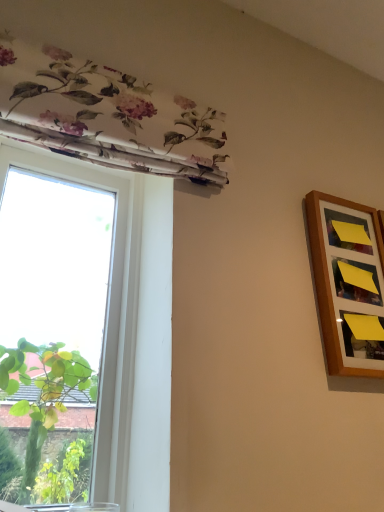
Locate an element on the screen. This screenshot has width=384, height=512. white fabric window at upper left is located at coordinates (107, 311).

This screenshot has height=512, width=384. What do you see at coordinates (107, 311) in the screenshot? I see `white fabric window at upper left` at bounding box center [107, 311].

The image size is (384, 512). What do you see at coordinates (348, 283) in the screenshot? I see `wooden picture frame at right` at bounding box center [348, 283].

At what (x,y) coordinates should I click in order to perform the action: click on wooden picture frame at right. Please return your answer as a coordinate pair (x, y). This screenshot has height=512, width=384. Looking at the image, I should click on (348, 283).

You are a GUI agent. You are given a task and a screenshot of the screen. Output one action in this format:
    pyautogui.click(x=<x>, y=<y>)
    Task: Click on the white fabric window at upper left
    The width and height of the screenshot is (384, 512).
    Given the screenshot: What is the action you would take?
    pyautogui.click(x=107, y=311)

Considering the positions of objects white fabric window at upper left and wooden picture frame at right in the image provided, who is more to the right, white fabric window at upper left or wooden picture frame at right?

wooden picture frame at right.

Does white fabric window at upper left come behind wooden picture frame at right?

No, it is in front of wooden picture frame at right.

Which point is more forward, (106, 490) or (328, 231)?

The point (106, 490) is closer to the camera.

From the image's perspective, would you say white fabric window at upper left is shown under wooden picture frame at right?

Yes.

From a real-world perspective, is white fabric window at upper left under wooden picture frame at right?

Yes, from a real-world perspective, white fabric window at upper left is beneath wooden picture frame at right.

Is white fabric window at upper left wider than wooden picture frame at right?

Correct, the width of white fabric window at upper left exceeds that of wooden picture frame at right.

Does white fabric window at upper left have a lesser height compared to wooden picture frame at right?

In fact, white fabric window at upper left may be taller than wooden picture frame at right.

Can you confirm if white fabric window at upper left is bigger than wooden picture frame at right?

Correct, white fabric window at upper left is larger in size than wooden picture frame at right.

Is white fabric window at upper left spatially inside wooden picture frame at right, or outside of it?

white fabric window at upper left is not enclosed by wooden picture frame at right.

Is white fabric window at upper left positioned far away from wooden picture frame at right?

No, white fabric window at upper left is not far away from wooden picture frame at right.

Looking at this image, is wooden picture frame at right at the back of white fabric window at upper left?

No, white fabric window at upper left's orientation is not away from wooden picture frame at right.

What's the angular difference between white fabric window at upper left and wooden picture frame at right's facing directions?

0.289 degrees.

How distant is white fabric window at upper left from wooden picture frame at right?

A distance of 22.70 inches exists between white fabric window at upper left and wooden picture frame at right.

Locate an element on the screen. The width and height of the screenshot is (384, 512). window located on the left of wooden picture frame at right is located at coordinates (107, 311).

Visually, is wooden picture frame at right positioned to the left or to the right of white fabric window at upper left?

In the image, wooden picture frame at right appears on the right side of white fabric window at upper left.

Does wooden picture frame at right come behind white fabric window at upper left?

Yes, wooden picture frame at right is further from the camera.

Which point is more forward, [350,317] or [134,227]?

The point [350,317] is more forward.

From the image's perspective, is wooden picture frame at right below white fabric window at upper left?

No.

From a real-world perspective, is wooden picture frame at right physically located above or below white fabric window at upper left?

In terms of real-world spatial position, wooden picture frame at right is above white fabric window at upper left.

Considering the relative sizes of wooden picture frame at right and white fabric window at upper left in the image provided, is wooden picture frame at right thinner than white fabric window at upper left?

Indeed, wooden picture frame at right has a lesser width compared to white fabric window at upper left.

Which of these two, wooden picture frame at right or white fabric window at upper left, stands taller?

Standing taller between the two is white fabric window at upper left.

Can you confirm if wooden picture frame at right is smaller than white fabric window at upper left?

Yes, wooden picture frame at right is smaller than white fabric window at upper left.

Would you say wooden picture frame at right is outside white fabric window at upper left?

Indeed, wooden picture frame at right is completely outside white fabric window at upper left.

Is wooden picture frame at right next to white fabric window at upper left?

No, wooden picture frame at right is not with white fabric window at upper left.

Could you tell me if wooden picture frame at right is facing white fabric window at upper left?

No, wooden picture frame at right is not facing towards white fabric window at upper left.

How many degrees apart are the facing directions of wooden picture frame at right and white fabric window at upper left?

The angle between the facing direction of wooden picture frame at right and the facing direction of white fabric window at upper left is 0.289 degrees.

The width and height of the screenshot is (384, 512). What are the coordinates of `picture frame above the white fabric window at upper left (from the image's perspective)` in the screenshot? It's located at (348, 283).

Image resolution: width=384 pixels, height=512 pixels. Find the location of `window lying on the left of wooden picture frame at right`. window lying on the left of wooden picture frame at right is located at coordinates (107, 311).

You are a GUI agent. You are given a task and a screenshot of the screen. Output one action in this format:
    pyautogui.click(x=<x>, y=<y>)
    Task: Click on the window lying below the wooden picture frame at right (from the image's perspective)
    Image resolution: width=384 pixels, height=512 pixels.
    Given the screenshot: What is the action you would take?
    pyautogui.click(x=107, y=311)